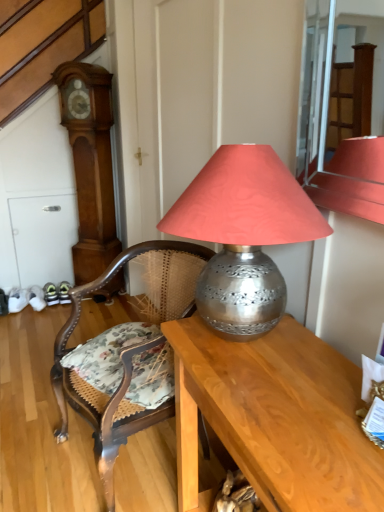
I want to click on free location to the left of wooden cane chair at center, so click(32, 450).